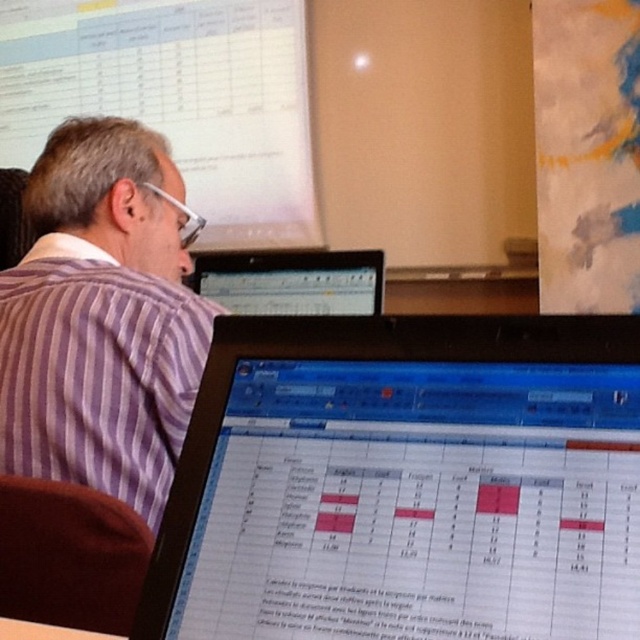
Question: Can you confirm if matte black laptop at upper center is bigger than white paper at center?

Choices:
 (A) yes
 (B) no

Answer: (A)

Question: Estimate the real-world distances between objects in this image. Which object is farther from the matte black laptop at upper center?

Choices:
 (A) brown fabric at lower left
 (B) purple striped shirt at left
 (C) matte black monitor at center
 (D) white paper at center

Answer: (C)

Question: Is matte black monitor at center closer to camera compared to matte black laptop at upper center?

Choices:
 (A) no
 (B) yes

Answer: (B)

Question: Which of these objects is positioned farthest from the white paper at center?

Choices:
 (A) brown fabric at lower left
 (B) matte black monitor at center
 (C) matte black laptop at upper center

Answer: (C)

Question: Which point appears closest to the camera in this image?

Choices:
 (A) (90, 612)
 (B) (323, 257)
 (C) (38, 625)
 (D) (444, 456)

Answer: (D)

Question: Is matte black monitor at center to the right of matte black laptop at upper center from the viewer's perspective?

Choices:
 (A) yes
 (B) no

Answer: (A)